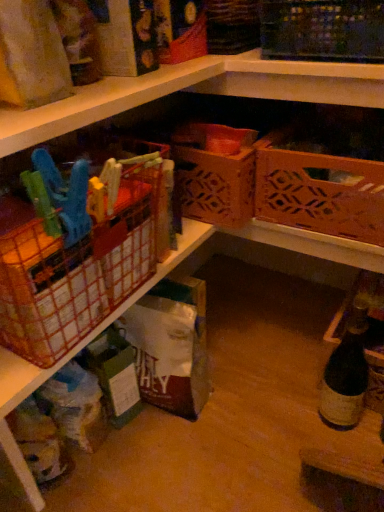
This screenshot has width=384, height=512. What do you see at coordinates (170, 346) in the screenshot? I see `brown cardboard box at center` at bounding box center [170, 346].

You are a GUI agent. You are given a task and a screenshot of the screen. Output one action in this format:
    pyautogui.click(x=<x>, y=<y>)
    Task: Click on the brown cardboard box at center
    The height and width of the screenshot is (512, 384).
    Given the screenshot: What is the action you would take?
    pyautogui.click(x=170, y=346)

Identify the location of brown cardboard box at center. The height and width of the screenshot is (512, 384). (170, 346).

From a real-world perspective, is brown cardboard box at center located higher than wooden lattice basket at center, arranged as the 2th basket when viewed from the right?

No, from a real-world perspective, brown cardboard box at center is not on top of wooden lattice basket at center, arranged as the 2th basket when viewed from the right.

Which basket is the 1st one when counting from the front of the brown cardboard box at center? Please provide its 2D coordinates.

[(215, 172)]

Which is more to the right, brown cardboard box at center or wooden lattice basket at center, which appears as the second basket when viewed from the left?

Positioned to the right is wooden lattice basket at center, which appears as the second basket when viewed from the left.

Is brown cardboard box at center outside of wooden lattice basket at center, arranged as the 2th basket when viewed from the right?

brown cardboard box at center is positioned outside wooden lattice basket at center, arranged as the 2th basket when viewed from the right.

From a real-world perspective, between orange plastic basket at left, which is counted as the first basket, starting from the left, and brown cardboard box at center, who is vertically higher?

From a 3D spatial view, orange plastic basket at left, which is counted as the first basket, starting from the left, is above.

Is orange plastic basket at left, the 3th basket in the right-to-left sequence, positioned beyond the bounds of brown cardboard box at center?

Indeed, orange plastic basket at left, the 3th basket in the right-to-left sequence, is completely outside brown cardboard box at center.

Which of these two, orange plastic basket at left, the 3th basket in the right-to-left sequence, or brown cardboard box at center, is thinner?

brown cardboard box at center.

Are orange plastic basket at left, the 3th basket in the right-to-left sequence, and brown cardboard box at center making contact?

There is a gap between orange plastic basket at left, the 3th basket in the right-to-left sequence, and brown cardboard box at center.

Which of these two, wooden lattice basket at center, which appears as the second basket when viewed from the left, or wooden lattice basket at upper right, the third basket viewed from the left, is smaller?

wooden lattice basket at center, which appears as the second basket when viewed from the left, is smaller.

Is wooden lattice basket at center, arranged as the 2th basket when viewed from the right, positioned beyond the bounds of wooden lattice basket at upper right, positioned as the first basket in right-to-left order?

That's correct, wooden lattice basket at center, arranged as the 2th basket when viewed from the right, is outside of wooden lattice basket at upper right, positioned as the first basket in right-to-left order.

From the image's perspective, which object appears higher, wooden lattice basket at center, which appears as the second basket when viewed from the left, or wooden lattice basket at upper right, positioned as the first basket in right-to-left order?

wooden lattice basket at center, which appears as the second basket when viewed from the left, is shown above in the image.

Does wooden lattice basket at center, which appears as the second basket when viewed from the left, have a greater height compared to wooden lattice basket at upper right, the third basket viewed from the left?

Yes.

Consider the image. Is wooden lattice basket at center, which appears as the second basket when viewed from the left, not near brown cardboard box at center?

No, wooden lattice basket at center, which appears as the second basket when viewed from the left, is not far from brown cardboard box at center.

From a real-world perspective, between wooden lattice basket at center, which appears as the second basket when viewed from the left, and brown cardboard box at center, who is vertically lower?

brown cardboard box at center.

Image resolution: width=384 pixels, height=512 pixels. Find the location of `the 3rd basket above the brown cardboard box at center (from the image's perspective)`. the 3rd basket above the brown cardboard box at center (from the image's perspective) is located at coordinates (215, 172).

Considering the sizes of objects dark brown glass bottle at lower right and orange plastic basket at left, the 3th basket in the right-to-left sequence, in the image provided, who is bigger, dark brown glass bottle at lower right or orange plastic basket at left, the 3th basket in the right-to-left sequence,?

orange plastic basket at left, the 3th basket in the right-to-left sequence, is bigger.

From a real-world perspective, which is physically above, dark brown glass bottle at lower right or orange plastic basket at left, the 3th basket in the right-to-left sequence?

In real-world perspective, orange plastic basket at left, the 3th basket in the right-to-left sequence, is above.

Is dark brown glass bottle at lower right directly adjacent to orange plastic basket at left, which is counted as the first basket, starting from the left?

No, dark brown glass bottle at lower right is not next to orange plastic basket at left, which is counted as the first basket, starting from the left.

Consider the image. Is dark brown glass bottle at lower right in contact with brown cardboard box at center?

They are not placed beside each other.

Consider the image. Does dark brown glass bottle at lower right turn towards brown cardboard box at center?

No, dark brown glass bottle at lower right is not aimed at brown cardboard box at center.

Is point (349, 384) in front of point (187, 301)?

That is True.

Considering the relative sizes of dark brown glass bottle at lower right and brown cardboard box at center in the image provided, is dark brown glass bottle at lower right shorter than brown cardboard box at center?

No, dark brown glass bottle at lower right is not shorter than brown cardboard box at center.

Considering the relative sizes of brown cardboard box at center and orange plastic basket at left, the 3th basket in the right-to-left sequence, in the image provided, is brown cardboard box at center thinner than orange plastic basket at left, the 3th basket in the right-to-left sequence,?

Yes.

Consider the image. Are brown cardboard box at center and orange plastic basket at left, the 3th basket in the right-to-left sequence, making contact?

No.

How many degrees apart are the facing directions of brown cardboard box at center and orange plastic basket at left, which is counted as the first basket, starting from the left?

The angular difference between brown cardboard box at center and orange plastic basket at left, which is counted as the first basket, starting from the left, is 0.978 degrees.

Could you tell me if brown cardboard box at center is facing orange plastic basket at left, which is counted as the first basket, starting from the left?

No, brown cardboard box at center is not turned towards orange plastic basket at left, which is counted as the first basket, starting from the left.

Find the location of a particular element. storage box below the wooden lattice basket at center, arranged as the 2th basket when viewed from the right (from the image's perspective) is located at coordinates (170, 346).

You are a GUI agent. You are given a task and a screenshot of the screen. Output one action in this format:
    pyautogui.click(x=<x>, y=<y>)
    Task: Click on the 1st basket above when counting from the brown cardboard box at center (from the image's perspective)
    This screenshot has width=384, height=512.
    Given the screenshot: What is the action you would take?
    pyautogui.click(x=75, y=273)

Which object lies nearer to the anchor point wooden lattice basket at center, arranged as the 2th basket when viewed from the right, wooden lattice basket at upper right, positioned as the first basket in right-to-left order, or dark brown glass bottle at lower right?

wooden lattice basket at upper right, positioned as the first basket in right-to-left order.

Which object lies nearer to the anchor point dark brown glass bottle at lower right, orange plastic basket at left, the 3th basket in the right-to-left sequence, or brown cardboard box at center?

Based on the image, brown cardboard box at center appears to be nearer to dark brown glass bottle at lower right.

Estimate the real-world distances between objects in this image. Which object is closer to wooden lattice basket at center, which appears as the second basket when viewed from the left, dark brown glass bottle at lower right or brown cardboard box at center?

brown cardboard box at center is closer to wooden lattice basket at center, which appears as the second basket when viewed from the left.

When comparing their distances from orange plastic basket at left, which is counted as the first basket, starting from the left, does wooden lattice basket at center, arranged as the 2th basket when viewed from the right, or wooden lattice basket at upper right, the third basket viewed from the left, seem closer?

wooden lattice basket at center, arranged as the 2th basket when viewed from the right, lies closer to orange plastic basket at left, which is counted as the first basket, starting from the left, than the other object.

When comparing their distances from wooden lattice basket at center, arranged as the 2th basket when viewed from the right, does orange plastic basket at left, the 3th basket in the right-to-left sequence, or brown cardboard box at center seem further?

Based on the image, orange plastic basket at left, the 3th basket in the right-to-left sequence, appears to be further to wooden lattice basket at center, arranged as the 2th basket when viewed from the right.

Based on the photo, considering their positions, is dark brown glass bottle at lower right positioned further to orange plastic basket at left, which is counted as the first basket, starting from the left, than brown cardboard box at center?

dark brown glass bottle at lower right is further to orange plastic basket at left, which is counted as the first basket, starting from the left.

Considering their positions, is dark brown glass bottle at lower right positioned further to brown cardboard box at center than orange plastic basket at left, which is counted as the first basket, starting from the left?

dark brown glass bottle at lower right lies further to brown cardboard box at center than the other object.

When comparing their distances from orange plastic basket at left, which is counted as the first basket, starting from the left, does brown cardboard box at center or wooden lattice basket at center, arranged as the 2th basket when viewed from the right, seem further?

wooden lattice basket at center, arranged as the 2th basket when viewed from the right, lies further to orange plastic basket at left, which is counted as the first basket, starting from the left, than the other object.

Find the location of a particular element. This screenshot has width=384, height=512. basket between orange plastic basket at left, the 3th basket in the right-to-left sequence, and wooden lattice basket at upper right, the third basket viewed from the left is located at coordinates (215, 172).

Locate an element on the screen. Image resolution: width=384 pixels, height=512 pixels. storage box between orange plastic basket at left, which is counted as the first basket, starting from the left, and wooden lattice basket at upper right, positioned as the first basket in right-to-left order, from left to right is located at coordinates (170, 346).

Where is `storage box between wooden lattice basket at upper right, positioned as the first basket in right-to-left order, and dark brown glass bottle at lower right vertically`? The width and height of the screenshot is (384, 512). storage box between wooden lattice basket at upper right, positioned as the first basket in right-to-left order, and dark brown glass bottle at lower right vertically is located at coordinates (170, 346).

What are the coordinates of `storage box between wooden lattice basket at center, which appears as the second basket when viewed from the left, and dark brown glass bottle at lower right in the up-down direction` in the screenshot? It's located at (170, 346).